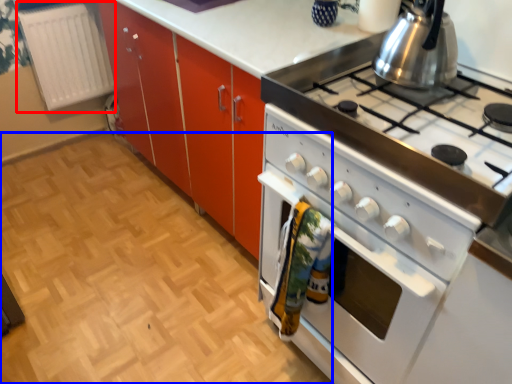
Question: Which object is closer to the camera taking this photo, radiator (highlighted by a red box) or plain (highlighted by a blue box)?

Choices:
 (A) radiator
 (B) plain

Answer: (B)